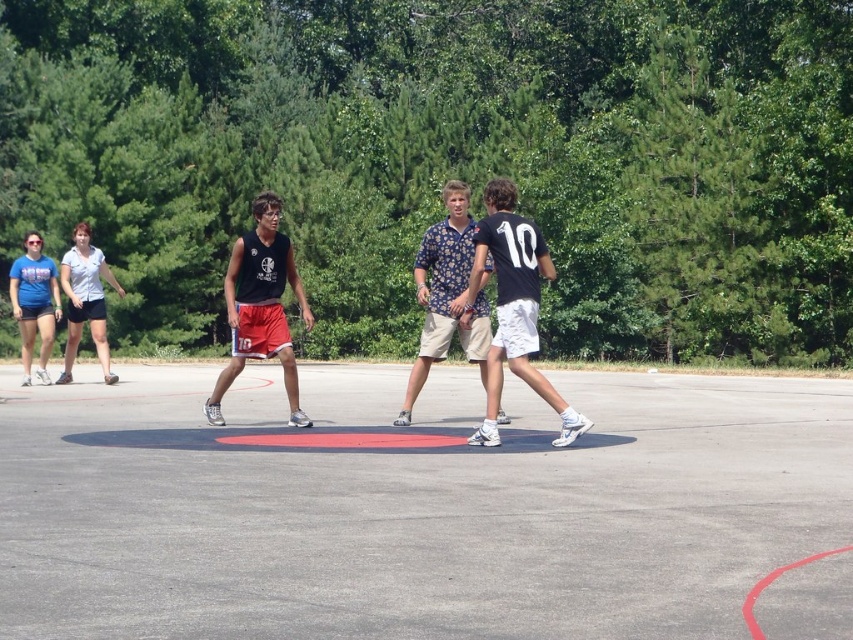
You are a photographer standing at the edge of the basketball court. You want to take a photo that includes both the point at coordinates point (x=753, y=397) and point (x=495, y=180). Which point should you focus on first to ensure both are in focus?

You should focus on point (x=495, y=180) first because it is closer to you than point (x=753, y=397), which is further away. This ensures the closer point is in focus, and the further point will also be sharp due to depth of field.